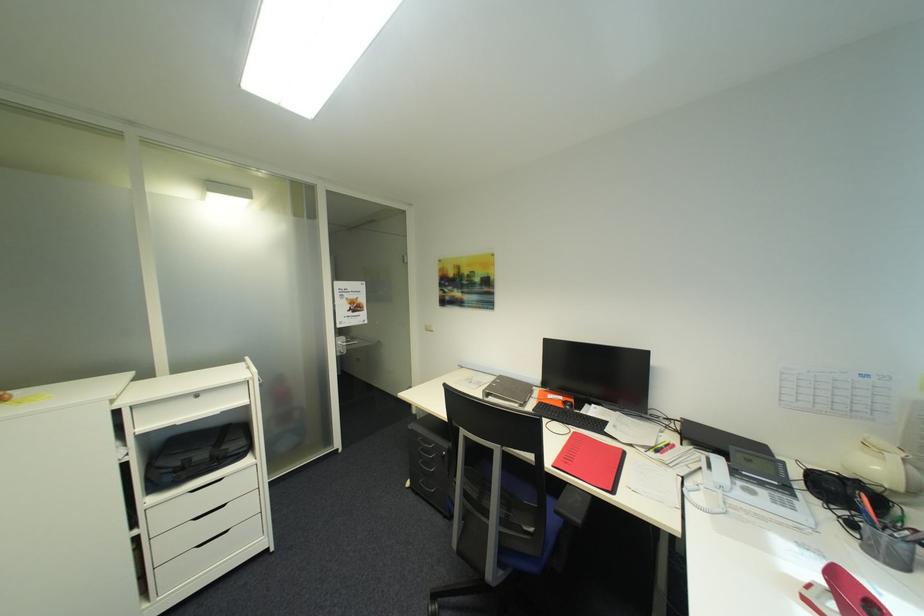
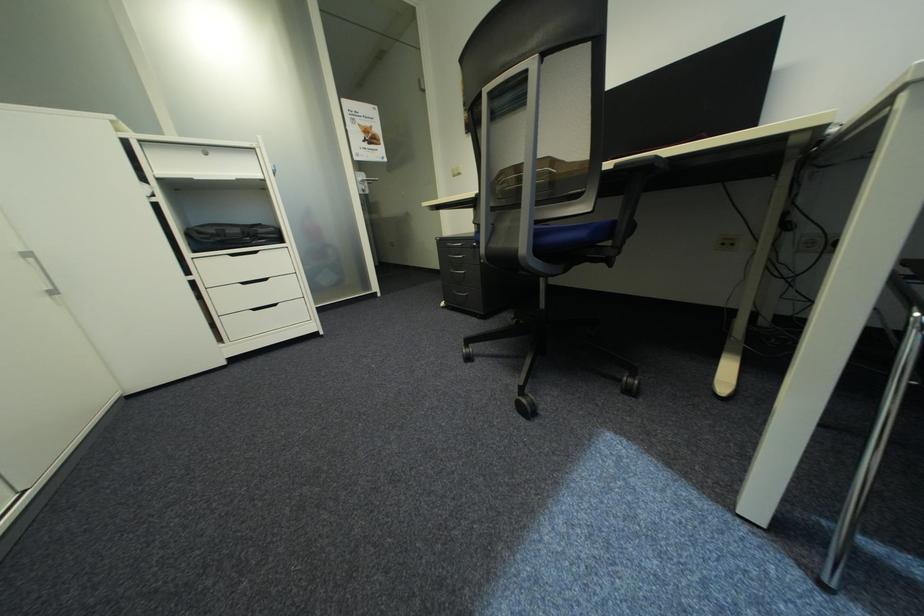
Question: What movement of the cameraman would produce the second image?

Choices:
 (A) Left
 (B) Right
 (C) Forward
 (D) Backward

Answer: (C)